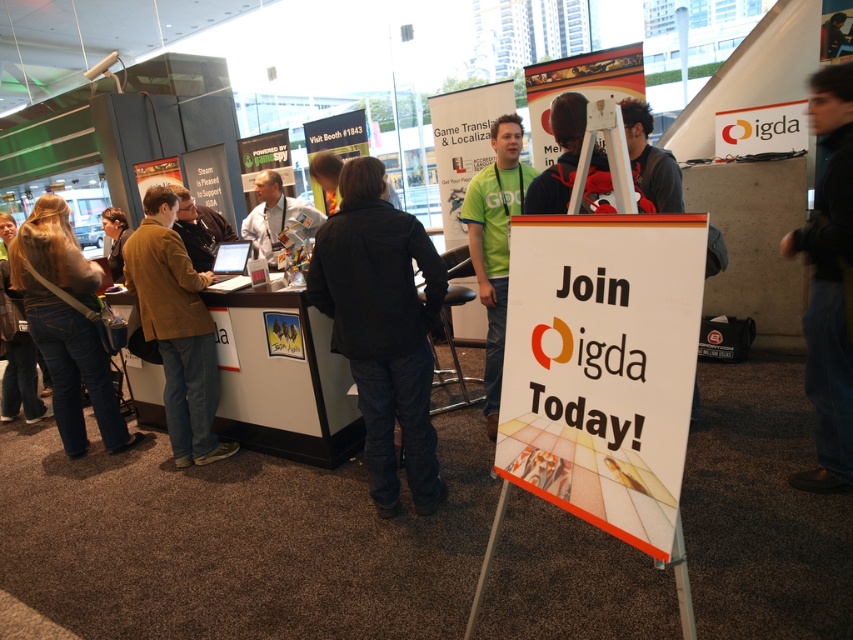
Is white paper sign at center to the right of black jacket at right from the viewer's perspective?

In fact, white paper sign at center is to the left of black jacket at right.

Who is taller, white paper sign at center or black jacket at right?

With more height is black jacket at right.

Find the location of a particular element. The width and height of the screenshot is (853, 640). white paper sign at center is located at coordinates (602, 365).

Is point (838, 314) in front of point (77, 262)?

Yes, point (838, 314) is in front of point (77, 262).

Is point (805, 486) farther from camera compared to point (70, 368)?

No, (805, 486) is closer to viewer.

Locate an element on the screen. black jacket at right is located at coordinates (828, 284).

Between green matte t-shirt at center and dark brown leather jacket at left, which one appears on the right side from the viewer's perspective?

green matte t-shirt at center is more to the right.

Who is more distant from viewer, (457, 141) or (13, 310)?

Positioned behind is point (457, 141).

Where is `green matte t-shirt at center`? Image resolution: width=853 pixels, height=640 pixels. green matte t-shirt at center is located at coordinates (463, 145).